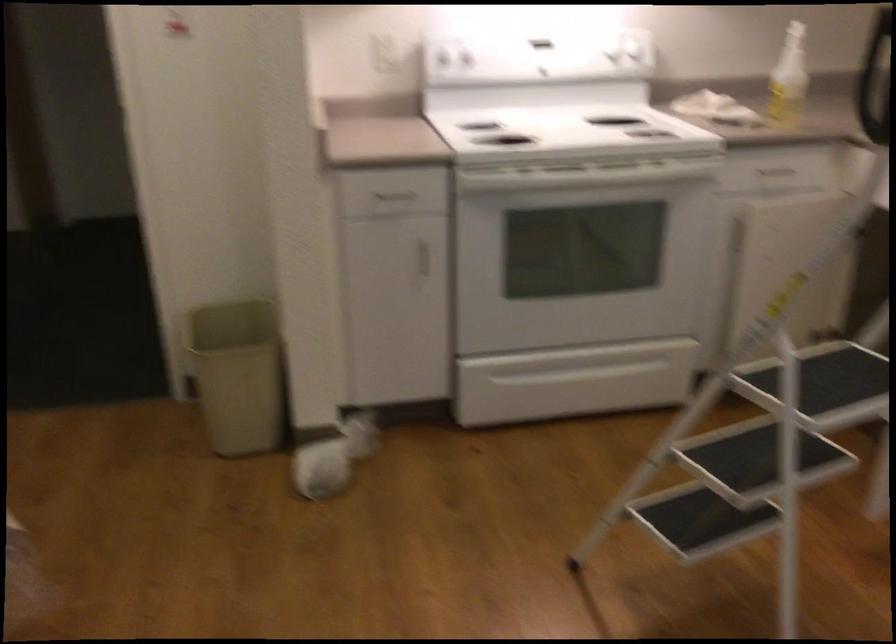
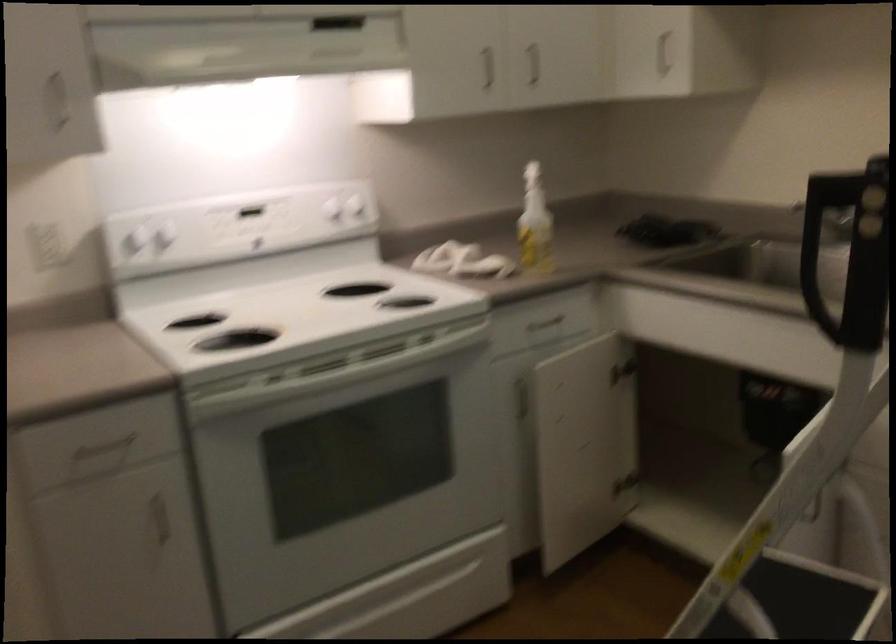
In the second image, find the point that corresponds to [421,254] in the first image.

(159, 514)